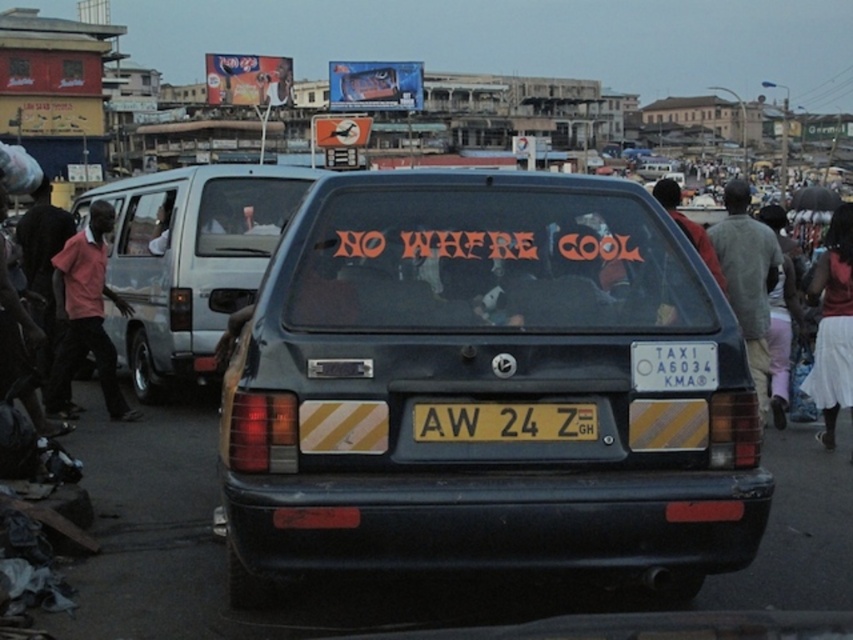
You are a pedestrian standing on the sidewalk and you see the matte black car at center and the pink fabric shirt at left. Which object is closer to the ground?

The matte black car at center is located below the pink fabric shirt at left, so it is closer to the ground.

You are a delivery driver who needs to attach a GPS tracker to your matte black car at center. The GPS tracker must be placed exactly 16 inches away from the yellow matte license plate at center. Based on the scene, can you safely attach the tracker on the car without exceeding the distance limit?

The matte black car at center and yellow matte license plate at center are 16.48 inches apart. Since the required distance is 16 inches, the GPS tracker can be placed within that range without exceeding the limit.